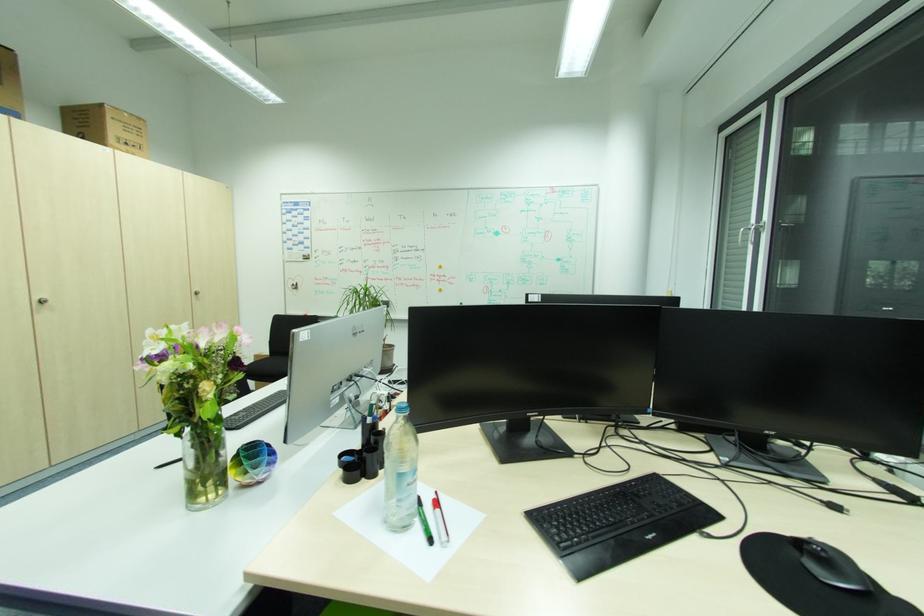
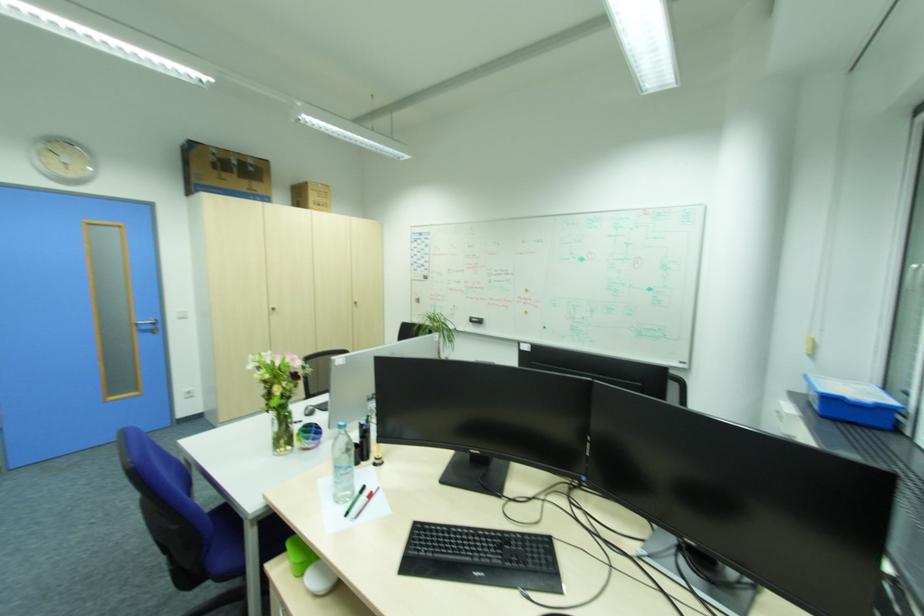
Question: What movement of the cameraman would produce the second image?

Choices:
 (A) Left
 (B) Right
 (C) Forward
 (D) Backward

Answer: (B)